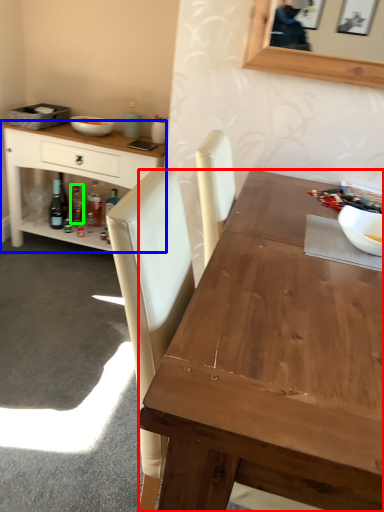
Question: Which object is positioned closest to desk (highlighted by a red box)? Select from cabinetry (highlighted by a blue box) and bottle (highlighted by a green box).

Choices:
 (A) cabinetry
 (B) bottle

Answer: (A)